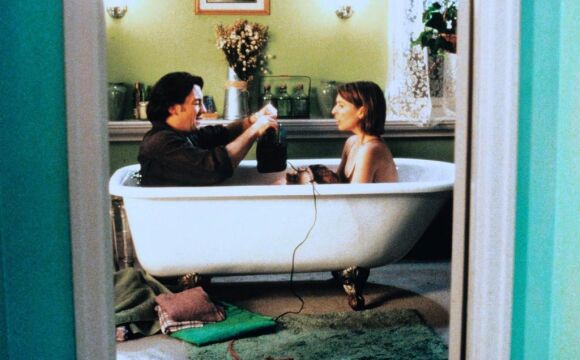
Find the location of a particular element. This screenshot has width=580, height=360. green bath mat is located at coordinates [x=340, y=338].